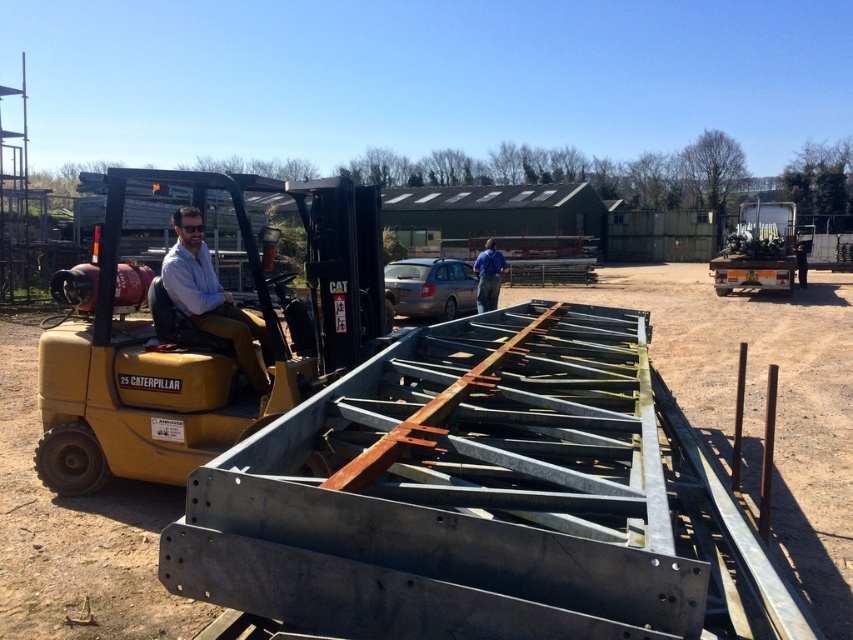
You are standing at the center of the construction site and want to locate the yellow metallic tractor at left. According to the coordinates provided, in which direction should you look to find it?

The yellow metallic tractor at left is located at coordinates point (207, 342). Since you are at the center, you should look to the left side of the site to find it.

What object is located at the coordinates point (207, 342) in the image?

The point (207, 342) marks the location of the yellow metallic tractor at left.

You are a worker on the construction site. You need to move a heavy load from the left side to the right side of the site. Which tractor should you use if the yellow metallic tractor at left has a higher lifting capacity than the metallic silver tractor at right?

You should use the yellow metallic tractor at left because it has a higher lifting capacity than the metallic silver tractor at right.